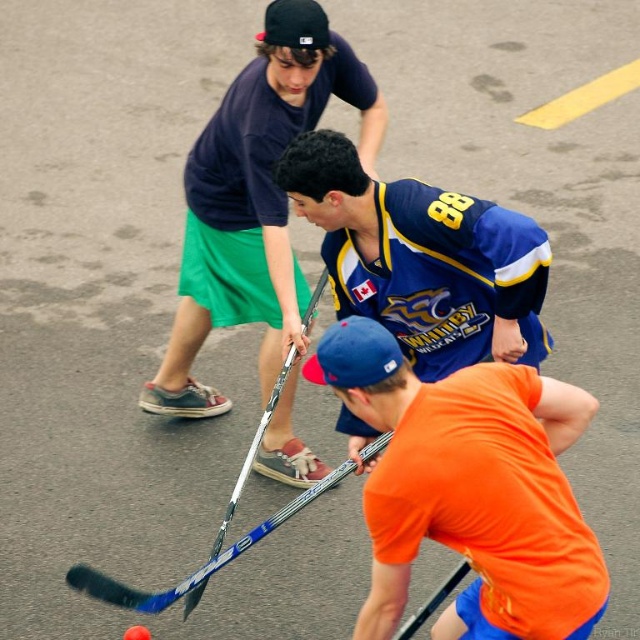
Can you confirm if orange matte hockey stick at lower center is smaller than matte black hockey stick at center?

Indeed, orange matte hockey stick at lower center has a smaller size compared to matte black hockey stick at center.

Can you confirm if orange matte hockey stick at lower center is thinner than matte black hockey stick at center?

Yes, orange matte hockey stick at lower center is thinner than matte black hockey stick at center.

What do you see at coordinates (468, 488) in the screenshot? This screenshot has height=640, width=640. I see `orange matte hockey stick at lower center` at bounding box center [468, 488].

This screenshot has height=640, width=640. Identify the location of orange matte hockey stick at lower center. (468, 488).